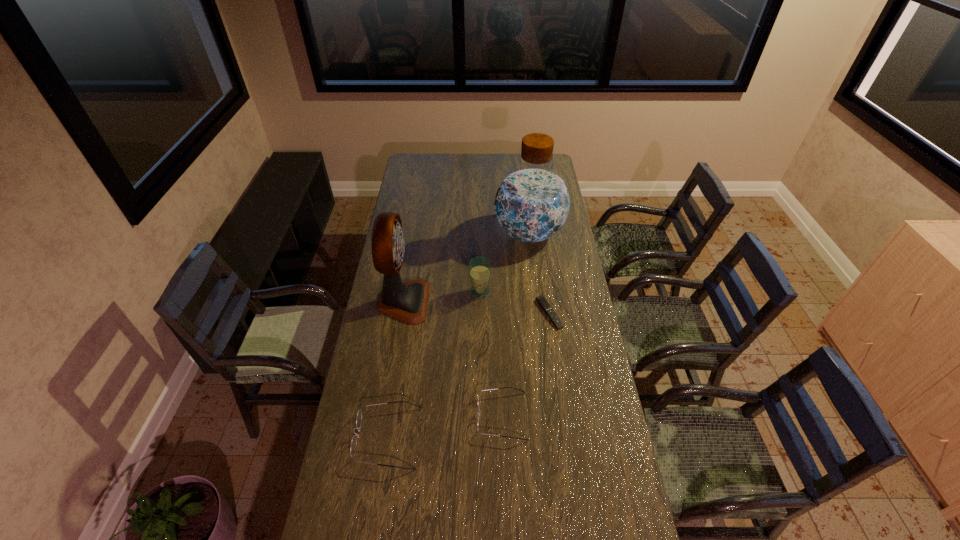
Locate an element on the screen. The height and width of the screenshot is (540, 960). vacant region at the left edge of the desktop is located at coordinates (420, 223).

Where is `vacant space at the right edge`? vacant space at the right edge is located at coordinates (561, 241).

You are a GUI agent. You are given a task and a screenshot of the screen. Output one action in this format:
    pyautogui.click(x=<x>, y=<y>)
    Task: Click on the vacant space at the far right corner of the desktop
    The width and height of the screenshot is (960, 540).
    Given the screenshot: What is the action you would take?
    pyautogui.click(x=554, y=168)

Identify the location of free area in between the third tallest object and the farthest object. This screenshot has height=540, width=960. (505, 262).

What are the coordinates of `vacant area that lies between the farthest object and the third shortest object` in the screenshot? It's located at click(459, 335).

Identify the location of vacant space that is in between the fourth tallest object and the fourth shortest object. (434, 364).

You are a GUI agent. You are given a task and a screenshot of the screen. Output one action in this format:
    pyautogui.click(x=<x>, y=<y>)
    Task: Click on the vacant region between the fan and the water jug
    
    Given the screenshot: What is the action you would take?
    pyautogui.click(x=467, y=267)

The width and height of the screenshot is (960, 540). Identify the location of free area in between the water jug and the third shortest object. (459, 335).

This screenshot has height=540, width=960. I want to click on vacant point located between the shorter spectacles and the taller spectacles, so click(x=445, y=427).

Identify the location of blank region between the shortest object and the fan. The height and width of the screenshot is (540, 960). (476, 308).